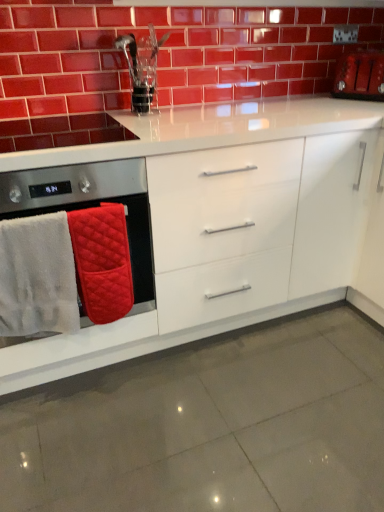
Question: Is quilted fabric oven mitts at left surrounding glossy ceramic brickwork at upper center?

Choices:
 (A) yes
 (B) no

Answer: (B)

Question: Does quilted fabric oven mitts at left lie in front of glossy ceramic brickwork at upper center?

Choices:
 (A) no
 (B) yes

Answer: (B)

Question: Does quilted fabric oven mitts at left have a larger size compared to glossy ceramic brickwork at upper center?

Choices:
 (A) no
 (B) yes

Answer: (B)

Question: Considering the relative sizes of quilted fabric oven mitts at left and glossy ceramic brickwork at upper center in the image provided, is quilted fabric oven mitts at left smaller than glossy ceramic brickwork at upper center?

Choices:
 (A) yes
 (B) no

Answer: (B)

Question: From a real-world perspective, is quilted fabric oven mitts at left located higher than glossy ceramic brickwork at upper center?

Choices:
 (A) no
 (B) yes

Answer: (A)

Question: From the image's perspective, is white fluffy bath towel at left, the 2th bath towel viewed from the right, above or below glossy ceramic brickwork at upper center?

Choices:
 (A) below
 (B) above

Answer: (A)

Question: Is white fluffy bath towel at left, the 2th bath towel viewed from the right, wider or thinner than glossy ceramic brickwork at upper center?

Choices:
 (A) thin
 (B) wide

Answer: (B)

Question: Which is correct: white fluffy bath towel at left, the 2th bath towel viewed from the right, is inside glossy ceramic brickwork at upper center, or outside of it?

Choices:
 (A) inside
 (B) outside

Answer: (B)

Question: Is point (8, 237) positioned closer to the camera than point (187, 94)?

Choices:
 (A) farther
 (B) closer

Answer: (B)

Question: Which is correct: quilted fabric oven mitts at left is inside white glossy cabinet at center, or outside of it?

Choices:
 (A) inside
 (B) outside

Answer: (A)

Question: Is quilted fabric oven mitts at left taller or shorter than white glossy cabinet at center?

Choices:
 (A) tall
 (B) short

Answer: (B)

Question: From a real-world perspective, relative to white glossy cabinet at center, is quilted fabric oven mitts at left vertically above or below?

Choices:
 (A) above
 (B) below

Answer: (A)

Question: Considering the relative positions of quilted fabric oven mitts at left and white glossy cabinet at center in the image provided, is quilted fabric oven mitts at left to the left or to the right of white glossy cabinet at center?

Choices:
 (A) left
 (B) right

Answer: (A)

Question: Is point (362, 80) closer or farther from the camera than point (36, 186)?

Choices:
 (A) farther
 (B) closer

Answer: (A)

Question: Is matte red toaster at upper right wider or thinner than quilted fabric oven mitts at left?

Choices:
 (A) thin
 (B) wide

Answer: (A)